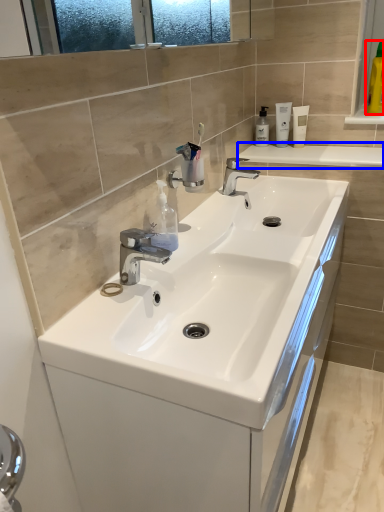
Question: Which point is further to the camera, mouthwash (highlighted by a red box) or counter top (highlighted by a blue box)?

Choices:
 (A) mouthwash
 (B) counter top

Answer: (A)